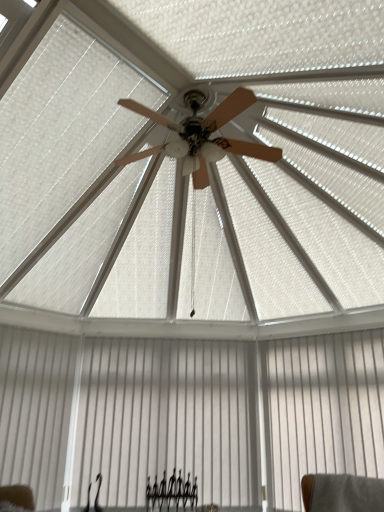
What do you see at coordinates (168, 419) in the screenshot?
I see `white matte curtain at lower center, the 2th curtain from the right` at bounding box center [168, 419].

You are a GUI agent. You are given a task and a screenshot of the screen. Output one action in this format:
    pyautogui.click(x=<x>, y=<y>)
    Task: Click on the white textured curtain at lower right, which appears as the 1th curtain when viewed from the right
    This screenshot has width=384, height=512.
    Given the screenshot: What is the action you would take?
    pyautogui.click(x=321, y=410)

This screenshot has height=512, width=384. What do you see at coordinates (35, 410) in the screenshot?
I see `white smooth shutter at lower left` at bounding box center [35, 410].

Find the location of a particular element. This screenshot has height=512, width=384. black metal fence at lower center is located at coordinates (172, 492).

Is white smooth shutter at lower left inside black metal fence at lower center?

Actually, white smooth shutter at lower left is outside black metal fence at lower center.

Considering the relative sizes of black metal fence at lower center and white smooth shutter at lower left in the image provided, is black metal fence at lower center smaller than white smooth shutter at lower left?

Correct, black metal fence at lower center occupies less space than white smooth shutter at lower left.

This screenshot has height=512, width=384. Identify the location of shutter located above the black metal fence at lower center (from the image's perspective). (35, 410).

In the image, is black metal fence at lower center on the left side or the right side of white smooth shutter at lower left?

black metal fence at lower center is positioned on white smooth shutter at lower left's right side.

Considering the positions of objects white textured curtain at lower right, which ranks as the second curtain in left-to-right order, and white matte curtain at lower center, which is counted as the 1th curtain, starting from the left, in the image provided, who is more to the left, white textured curtain at lower right, which ranks as the second curtain in left-to-right order, or white matte curtain at lower center, which is counted as the 1th curtain, starting from the left,?

white matte curtain at lower center, which is counted as the 1th curtain, starting from the left.

Is white textured curtain at lower right, which ranks as the second curtain in left-to-right order, bigger than white matte curtain at lower center, the 2th curtain from the right?

Yes.

In the scene shown: Is white textured curtain at lower right, which ranks as the second curtain in left-to-right order, taller than white matte curtain at lower center, which is counted as the 1th curtain, starting from the left?

Incorrect, the height of white textured curtain at lower right, which ranks as the second curtain in left-to-right order, is not larger of that of white matte curtain at lower center, which is counted as the 1th curtain, starting from the left.

Find the location of a particular element. This screenshot has width=384, height=512. curtain above the white matte curtain at lower center, which is counted as the 1th curtain, starting from the left (from the image's perspective) is located at coordinates (321, 410).

Which object is further away from the camera taking this photo, white matte curtain at lower center, the 2th curtain from the right, or white textured curtain at lower right, which appears as the 1th curtain when viewed from the right?

white matte curtain at lower center, the 2th curtain from the right, is more distant.

Considering the positions of points (180, 439) and (371, 332), is point (180, 439) closer to camera compared to point (371, 332)?

No, (180, 439) is further to viewer.

What's the angular difference between white matte curtain at lower center, which is counted as the 1th curtain, starting from the left, and white textured curtain at lower right, which appears as the 1th curtain when viewed from the right,'s facing directions?

The angle between the facing direction of white matte curtain at lower center, which is counted as the 1th curtain, starting from the left, and the facing direction of white textured curtain at lower right, which appears as the 1th curtain when viewed from the right, is 45.8 degrees.

Which is more to the left, white textured curtain at lower right, which appears as the 1th curtain when viewed from the right, or white smooth shutter at lower left?

From the viewer's perspective, white smooth shutter at lower left appears more on the left side.

Is white textured curtain at lower right, which ranks as the second curtain in left-to-right order, further to the viewer compared to white smooth shutter at lower left?

No.

Can you confirm if white textured curtain at lower right, which ranks as the second curtain in left-to-right order, is bigger than white smooth shutter at lower left?

Yes.

Between white smooth shutter at lower left and white textured curtain at lower right, which appears as the 1th curtain when viewed from the right, which one has larger width?

With larger width is white smooth shutter at lower left.

Does point (43, 377) appear closer or farther from the camera than point (378, 449)?

Point (43, 377) is farther from the camera than point (378, 449).

Considering the positions of objects white smooth shutter at lower left and white textured curtain at lower right, which ranks as the second curtain in left-to-right order, in the image provided, who is more to the left, white smooth shutter at lower left or white textured curtain at lower right, which ranks as the second curtain in left-to-right order,?

white smooth shutter at lower left is more to the left.

Would you consider white smooth shutter at lower left to be distant from white matte curtain at lower center, which is counted as the 1th curtain, starting from the left?

They are positioned close to each other.

How many degrees apart are the facing directions of white smooth shutter at lower left and white matte curtain at lower center, the 2th curtain from the right?

The angle between the facing direction of white smooth shutter at lower left and the facing direction of white matte curtain at lower center, the 2th curtain from the right, is 44.8 degrees.

Measure the distance between white smooth shutter at lower left and white matte curtain at lower center, which is counted as the 1th curtain, starting from the left.

24.99 inches.

From the image's perspective, would you say white smooth shutter at lower left is shown under white matte curtain at lower center, the 2th curtain from the right?

Actually, white smooth shutter at lower left appears above white matte curtain at lower center, the 2th curtain from the right, in the image.

From the image's perspective, is white matte curtain at lower center, the 2th curtain from the right, located above white smooth shutter at lower left?

Actually, white matte curtain at lower center, the 2th curtain from the right, appears below white smooth shutter at lower left in the image.

Visually, is white matte curtain at lower center, the 2th curtain from the right, positioned to the left or to the right of white smooth shutter at lower left?

In the image, white matte curtain at lower center, the 2th curtain from the right, appears on the right side of white smooth shutter at lower left.

Between white matte curtain at lower center, the 2th curtain from the right, and white smooth shutter at lower left, which one has larger width?

With larger width is white smooth shutter at lower left.

Choose the correct answer: Is white matte curtain at lower center, which is counted as the 1th curtain, starting from the left, inside white smooth shutter at lower left or outside it?

white matte curtain at lower center, which is counted as the 1th curtain, starting from the left, is not enclosed by white smooth shutter at lower left.

Identify the location of shutter on the left of black metal fence at lower center. This screenshot has width=384, height=512. (35, 410).

In order to click on curtain in front of the white matte curtain at lower center, the 2th curtain from the right in this screenshot , I will do `click(321, 410)`.

Considering their positions, is black metal fence at lower center positioned further to white matte curtain at lower center, which is counted as the 1th curtain, starting from the left, than white textured curtain at lower right, which appears as the 1th curtain when viewed from the right?

Based on the image, white textured curtain at lower right, which appears as the 1th curtain when viewed from the right, appears to be further to white matte curtain at lower center, which is counted as the 1th curtain, starting from the left.

Considering their positions, is black metal fence at lower center positioned further to white matte curtain at lower center, which is counted as the 1th curtain, starting from the left, than white smooth shutter at lower left?

Based on the image, white smooth shutter at lower left appears to be further to white matte curtain at lower center, which is counted as the 1th curtain, starting from the left.

Considering their positions, is white matte curtain at lower center, which is counted as the 1th curtain, starting from the left, positioned further to black metal fence at lower center than white smooth shutter at lower left?

Based on the image, white smooth shutter at lower left appears to be further to black metal fence at lower center.

When comparing their distances from white textured curtain at lower right, which appears as the 1th curtain when viewed from the right, does white matte curtain at lower center, the 2th curtain from the right, or white smooth shutter at lower left seem further?

white smooth shutter at lower left is positioned further to the anchor white textured curtain at lower right, which appears as the 1th curtain when viewed from the right.

Which object lies nearer to the anchor point black metal fence at lower center, white textured curtain at lower right, which appears as the 1th curtain when viewed from the right, or white matte curtain at lower center, which is counted as the 1th curtain, starting from the left?

white matte curtain at lower center, which is counted as the 1th curtain, starting from the left.

When comparing their distances from black metal fence at lower center, does white smooth shutter at lower left or white matte curtain at lower center, the 2th curtain from the right, seem further?

white smooth shutter at lower left is positioned further to the anchor black metal fence at lower center.

When comparing their distances from white textured curtain at lower right, which appears as the 1th curtain when viewed from the right, does white matte curtain at lower center, which is counted as the 1th curtain, starting from the left, or black metal fence at lower center seem closer?

white matte curtain at lower center, which is counted as the 1th curtain, starting from the left, lies closer to white textured curtain at lower right, which appears as the 1th curtain when viewed from the right, than the other object.

Which object lies nearer to the anchor point white matte curtain at lower center, which is counted as the 1th curtain, starting from the left, white smooth shutter at lower left or white textured curtain at lower right, which ranks as the second curtain in left-to-right order?

The object closer to white matte curtain at lower center, which is counted as the 1th curtain, starting from the left, is white smooth shutter at lower left.

The image size is (384, 512). I want to click on furniture situated between white smooth shutter at lower left and white textured curtain at lower right, which appears as the 1th curtain when viewed from the right, from left to right, so click(172, 492).

Find the location of a particular element. This screenshot has width=384, height=512. curtain located between white smooth shutter at lower left and white textured curtain at lower right, which appears as the 1th curtain when viewed from the right, in the left-right direction is located at coordinates (168, 419).

Identify the location of furniture between white matte curtain at lower center, which is counted as the 1th curtain, starting from the left, and white textured curtain at lower right, which appears as the 1th curtain when viewed from the right, in the horizontal direction. The height and width of the screenshot is (512, 384). (172, 492).

At what (x,y) coordinates should I click in order to perform the action: click on curtain located between white smooth shutter at lower left and black metal fence at lower center in the left-right direction. Please return your answer as a coordinate pair (x, y). The image size is (384, 512). Looking at the image, I should click on (168, 419).